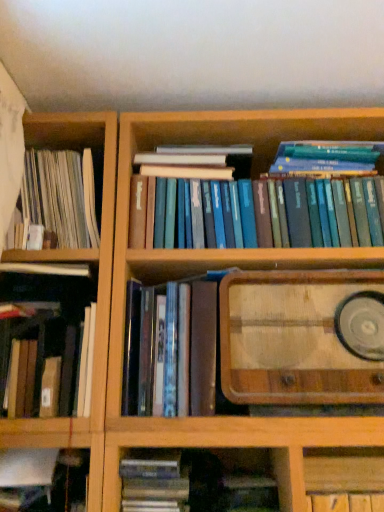
Question: Is hardcover book at lower left, marked as the 2th book in a left-to-right arrangement, at the back of wooden cabinet at lower right?

Choices:
 (A) no
 (B) yes

Answer: (A)

Question: Does wooden cabinet at lower right lie in front of hardcover book at lower left, the fifth book positioned from the right?

Choices:
 (A) no
 (B) yes

Answer: (A)

Question: Can you confirm if wooden cabinet at lower right is smaller than hardcover book at lower left, the fifth book positioned from the right?

Choices:
 (A) yes
 (B) no

Answer: (A)

Question: Is wooden cabinet at lower right located outside hardcover book at lower left, the fifth book positioned from the right?

Choices:
 (A) yes
 (B) no

Answer: (A)

Question: Does wooden cabinet at lower right have a greater width compared to hardcover book at lower left, the fifth book positioned from the right?

Choices:
 (A) no
 (B) yes

Answer: (A)

Question: From the image's perspective, is white paperbacks at left, the first book in the left-to-right sequence, above or below wooden radio at center-right?

Choices:
 (A) below
 (B) above

Answer: (B)

Question: In terms of width, does white paperbacks at left, which is counted as the sixth book, starting from the right, look wider or thinner when compared to wooden radio at center-right?

Choices:
 (A) thin
 (B) wide

Answer: (A)

Question: In the image, is white paperbacks at left, the first book in the left-to-right sequence, positioned in front of or behind wooden radio at center-right?

Choices:
 (A) behind
 (B) front

Answer: (A)

Question: Is point (56, 157) positioned closer to the camera than point (319, 398)?

Choices:
 (A) closer
 (B) farther

Answer: (B)

Question: From the image's perspective, is wooden radio at center-right above or below white paperbacks at left, which is counted as the sixth book, starting from the right?

Choices:
 (A) below
 (B) above

Answer: (A)

Question: Which is correct: wooden radio at center-right is inside white paperbacks at left, which is counted as the sixth book, starting from the right, or outside of it?

Choices:
 (A) inside
 (B) outside

Answer: (B)

Question: Does point (286, 304) appear closer or farther from the camera than point (74, 210)?

Choices:
 (A) closer
 (B) farther

Answer: (A)

Question: Based on their sizes in the image, would you say wooden radio at center-right is bigger or smaller than white paperbacks at left, the first book in the left-to-right sequence?

Choices:
 (A) big
 (B) small

Answer: (A)

Question: Is matte plastic books at center, positioned as the fifth book in left-to-right order, taller or shorter than hardcover book at center, the 4th book when ordered from left to right?

Choices:
 (A) tall
 (B) short

Answer: (A)

Question: Looking at their shapes, would you say matte plastic books at center, positioned as the fifth book in left-to-right order, is wider or thinner than hardcover book at center, the 4th book when ordered from left to right?

Choices:
 (A) wide
 (B) thin

Answer: (A)